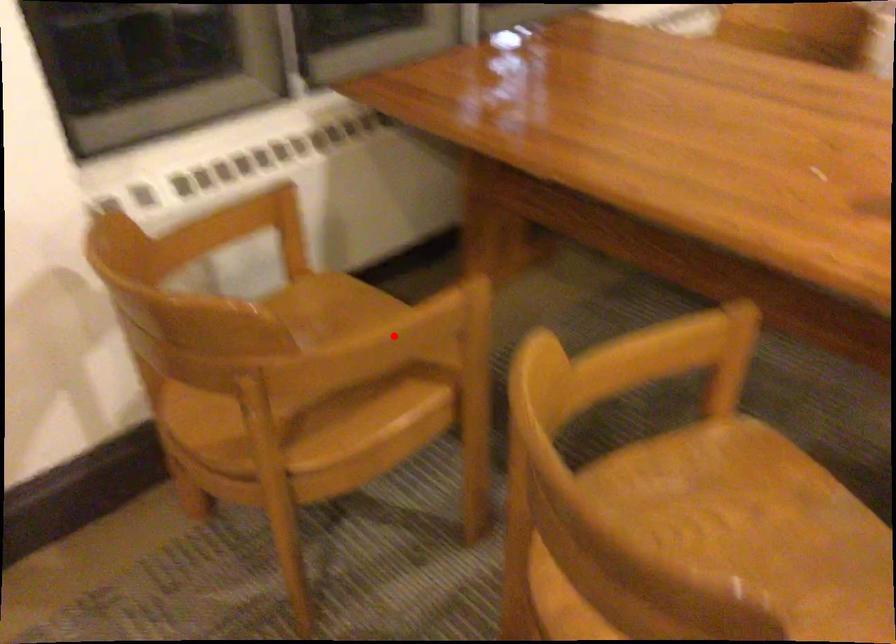
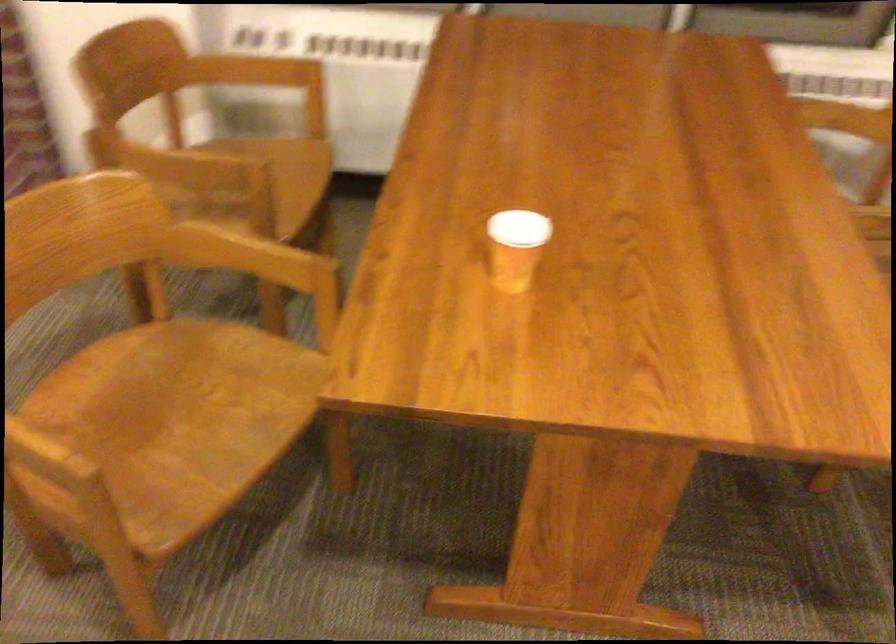
Where in the second image is the point corresponding to the highlighted location from the first image?

(169, 163)